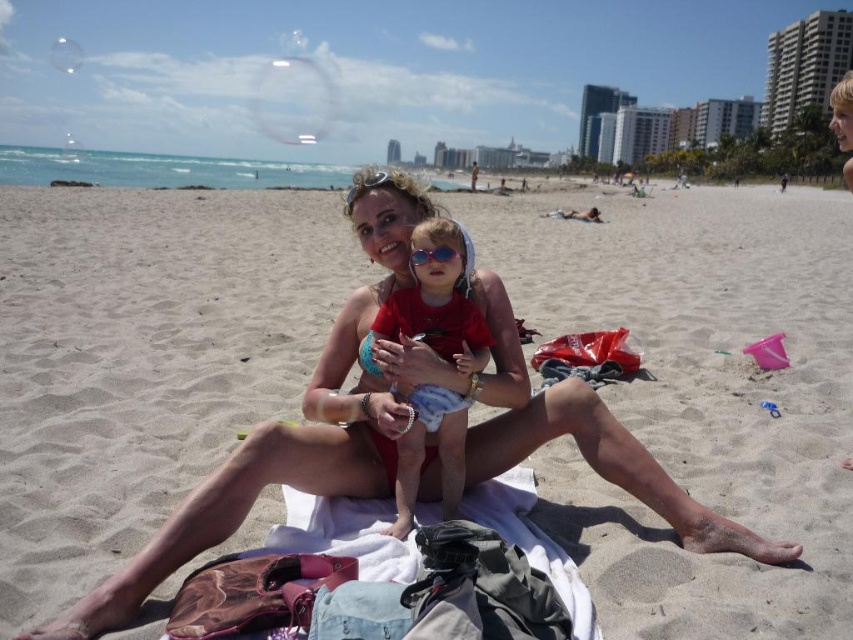
Question: Is matte red swimsuit at center thinner than sunglasses at center?

Choices:
 (A) yes
 (B) no

Answer: (B)

Question: Which point is closer to the camera?

Choices:
 (A) (413, 301)
 (B) (444, 250)
 (C) (675, 365)

Answer: (B)

Question: Considering the relative positions of matte red swimsuit at center and sunglasses at center in the image provided, where is matte red swimsuit at center located with respect to sunglasses at center?

Choices:
 (A) left
 (B) right

Answer: (A)

Question: Considering the real-world distances, which object is closest to the white sand towel at center?

Choices:
 (A) sunglasses at center
 (B) matte red swimsuit at center

Answer: (B)

Question: Which point appears closest to the camera in this image?

Choices:
 (A) (419, 253)
 (B) (461, 236)
 (C) (830, 529)

Answer: (A)

Question: Can you confirm if white sand towel at center is positioned to the right of sunglasses at center?

Choices:
 (A) no
 (B) yes

Answer: (A)